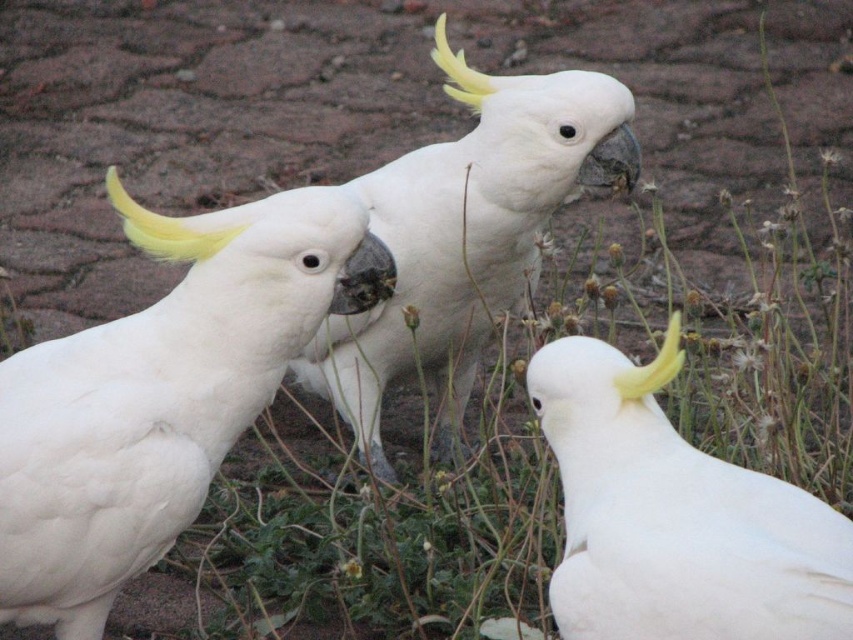
Question: Does white feathered parrot at left have a larger size compared to white feathered parrot at center?

Choices:
 (A) yes
 (B) no

Answer: (B)

Question: Which point is farther to the camera?

Choices:
 (A) white feathered parrot at left
 (B) white feathered parrot at lower right
 (C) white feathered parrot at center

Answer: (C)

Question: Based on their relative distances, which object is nearer to the white feathered parrot at center?

Choices:
 (A) white feathered parrot at lower right
 (B) white feathered parrot at left

Answer: (B)

Question: From the image, what is the correct spatial relationship of white feathered parrot at left in relation to white feathered parrot at lower right?

Choices:
 (A) left
 (B) right

Answer: (A)

Question: Estimate the real-world distances between objects in this image. Which object is farther from the white feathered parrot at center?

Choices:
 (A) white feathered parrot at left
 (B) white feathered parrot at lower right

Answer: (B)

Question: Is white feathered parrot at left positioned at the back of white feathered parrot at lower right?

Choices:
 (A) yes
 (B) no

Answer: (A)